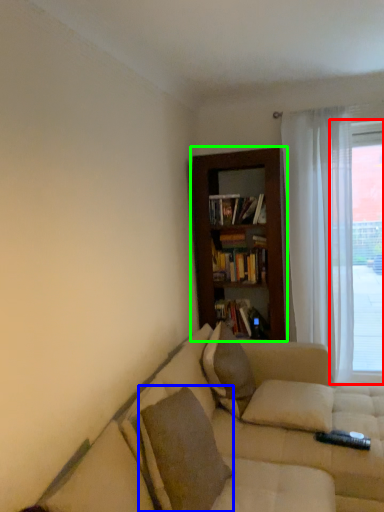
Question: Considering the real-world distances, which object is farthest from window (highlighted by a red box)? pillow (highlighted by a blue box) or bookcase (highlighted by a green box)?

Choices:
 (A) pillow
 (B) bookcase

Answer: (A)